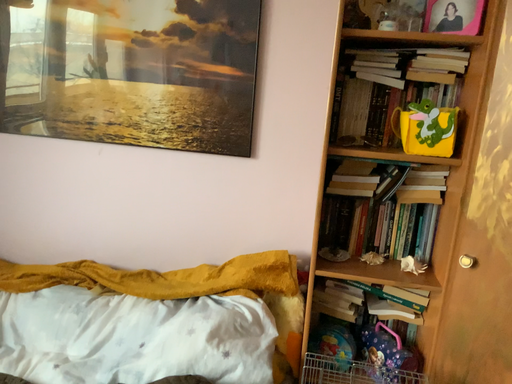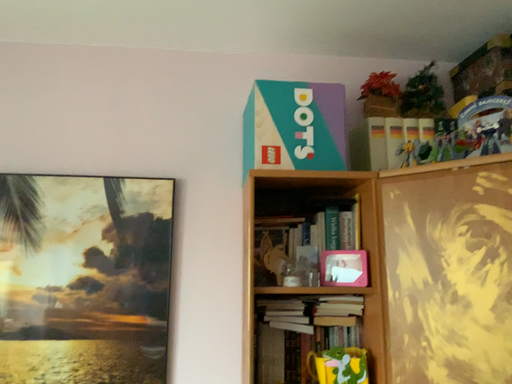
Question: Which way did the camera rotate in the video?

Choices:
 (A) rotated left
 (B) rotated right

Answer: (B)